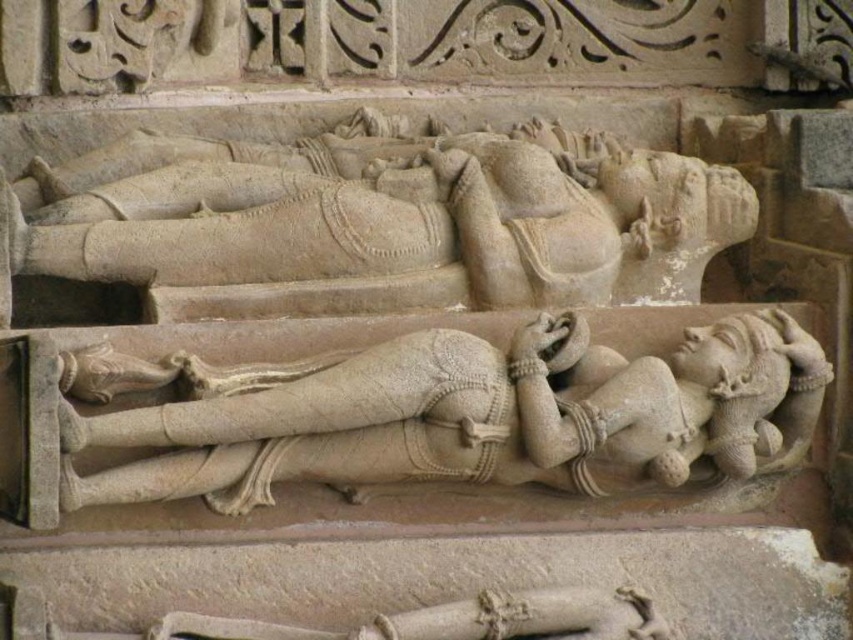
Is point (287, 250) positioned in front of point (277, 378)?

No, it is not.

Is stone statue at center in front of smooth beige statue at center?

No, it is behind smooth beige statue at center.

Measure the distance between point [560,260] and camera.

A distance of 16.28 meters exists between point [560,260] and camera.

You are a GUI agent. You are given a task and a screenshot of the screen. Output one action in this format:
    pyautogui.click(x=<x>, y=<y>)
    Task: Click on the stone statue at center
    
    Given the screenshot: What is the action you would take?
    pyautogui.click(x=379, y=220)